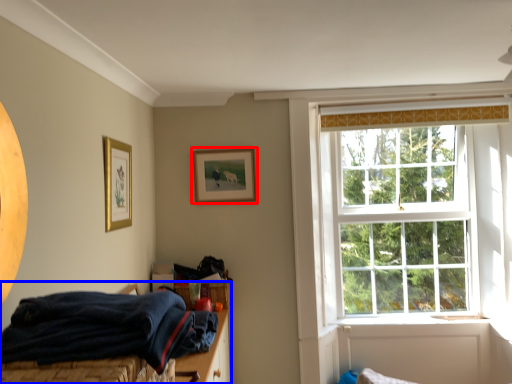
Question: Which object is closer to the camera taking this photo, picture frame (highlighted by a red box) or bed (highlighted by a blue box)?

Choices:
 (A) picture frame
 (B) bed

Answer: (B)